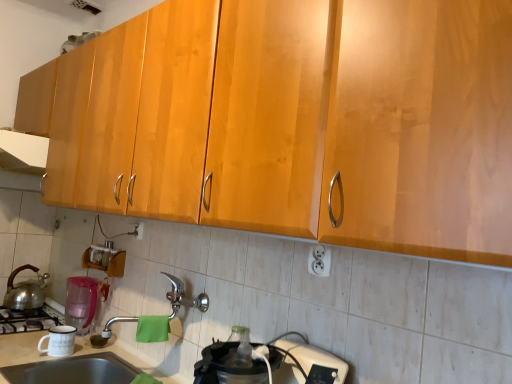
Find the location of a particular element. The width and height of the screenshot is (512, 384). vacant space situated above pink plastic pitcher at lower left, the second appliance positioned from the front (from a real-world perspective) is located at coordinates (86, 278).